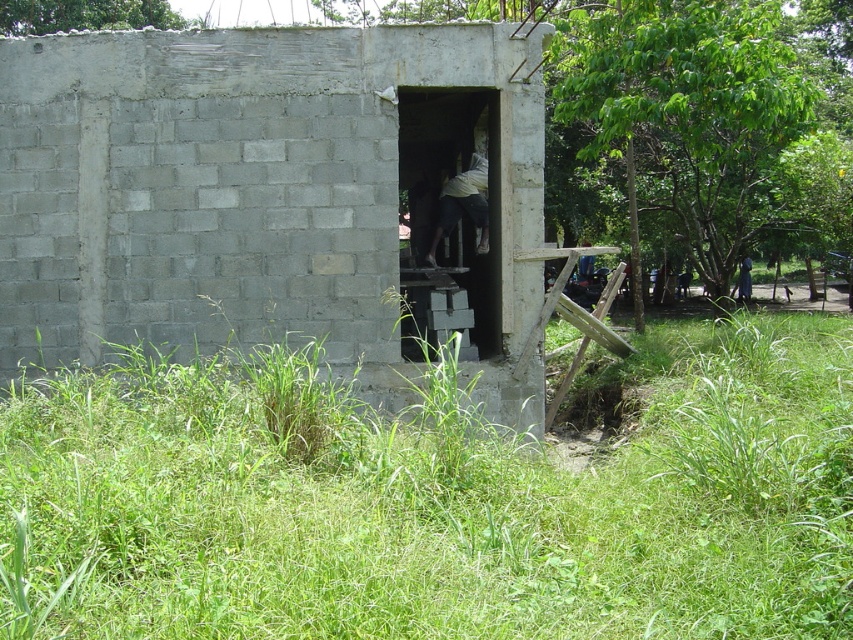
Is green grass at lower center bigger than gray concrete bunker at center?

Yes, green grass at lower center is bigger than gray concrete bunker at center.

Is green grass at lower center below gray concrete bunker at center?

Indeed, green grass at lower center is positioned under gray concrete bunker at center.

Who is more forward, (242,596) or (32,288)?

Positioned in front is point (242,596).

Locate an element on the screen. green grass at lower center is located at coordinates (437, 508).

Which of these two, light yellow shirt at center or dark blue fabric at center, stands taller?

light yellow shirt at center is taller.

Is point (468, 188) farther from viewer compared to point (747, 269)?

No, (468, 188) is in front of (747, 269).

Find the location of a particular element. light yellow shirt at center is located at coordinates (463, 205).

Does green grass at lower center have a larger size compared to light yellow shirt at center?

Yes.

Where is `green grass at lower center`? This screenshot has width=853, height=640. green grass at lower center is located at coordinates (437, 508).